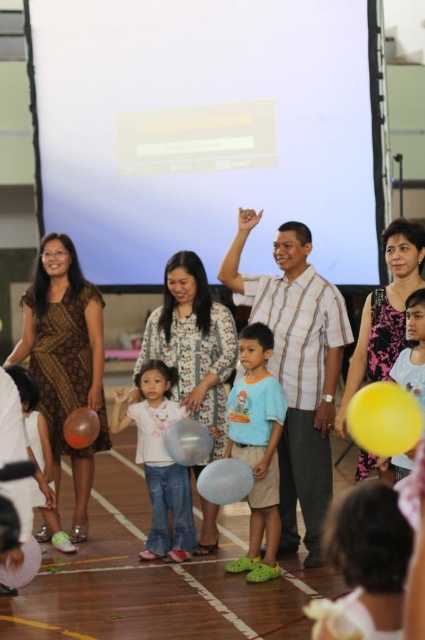
You are standing in the gymnasium and see the point marked at coordinates [224,481]. What object is located at that point?

The point at coordinates [224,481] corresponds to the translucent white balloon at center.

You are organizing a photo shoot and need to ensure that the two people wearing the matte white shirt at center and the white matte shirt at center are positioned so that their shirts do not overlap in the frame. Given their shirt sizes, which person should you place further back to prevent overlap?

The matte white shirt at center has a larger width than the white matte shirt at center. To prevent overlap, position the person wearing the matte white shirt at center further back since its larger size requires more space, while the person in the smaller white matte shirt at center can be placed closer to the front.

You are standing at the front of the room and want to move towards the two points marked in the image. Which point, point (78,604) or point (153,451), would you reach first?

You would reach point (78,604) first because it is closer to you than point (153,451).